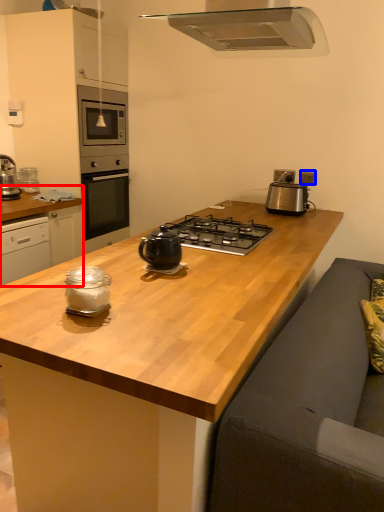
Question: Which point is closer to the camera, cabinetry (highlighted by a red box) or electric outlet (highlighted by a blue box)?

Choices:
 (A) cabinetry
 (B) electric outlet

Answer: (A)